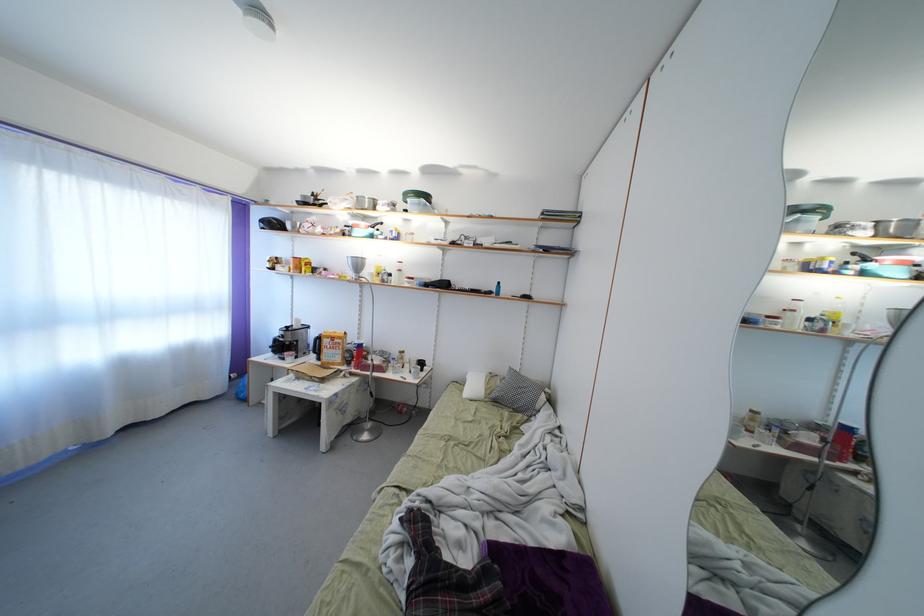
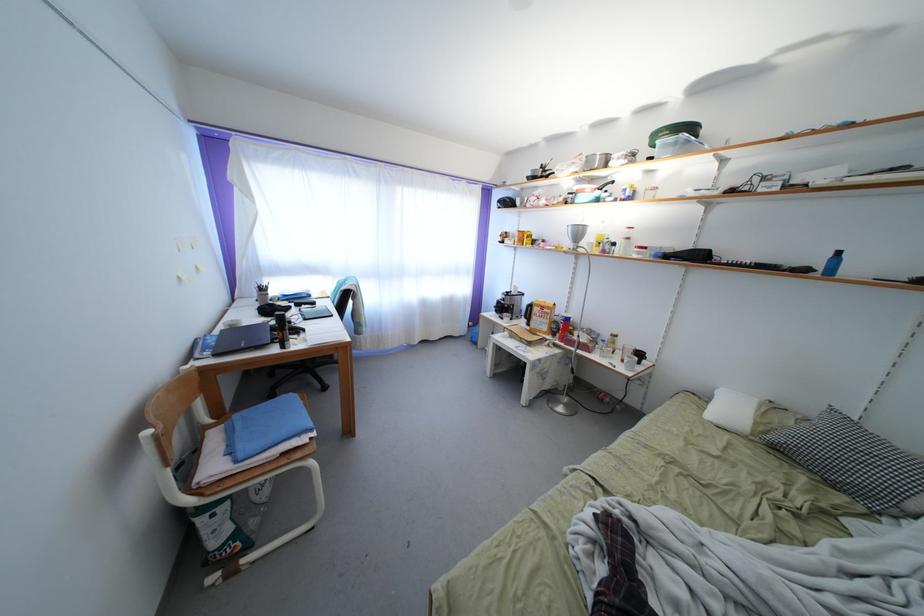
Where in the second image is the point corresponding to point (499, 400) from the first image?

(779, 444)